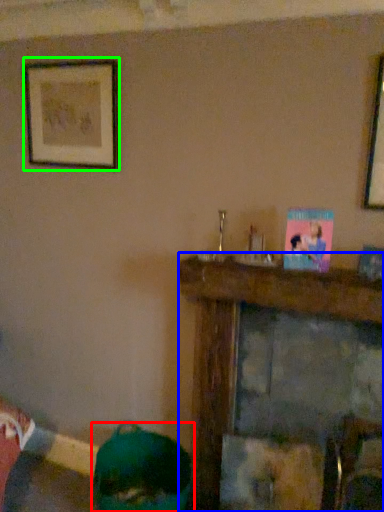
Question: Considering the real-world distances, which object is farthest from person (highlighted by a red box)? furniture (highlighted by a blue box) or picture frame (highlighted by a green box)?

Choices:
 (A) furniture
 (B) picture frame

Answer: (B)